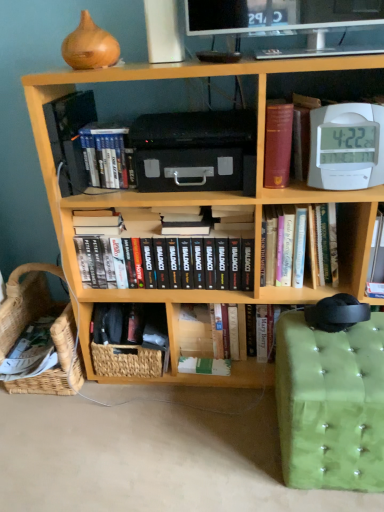
Question: Is wooden bookcase at center completely or partially outside of woven basket at lower left, acting as the 1th basket starting from the right?

Choices:
 (A) no
 (B) yes

Answer: (B)

Question: From a real-world perspective, is wooden bookcase at center under woven basket at lower left, the second basket viewed from the left?

Choices:
 (A) no
 (B) yes

Answer: (A)

Question: Is wooden bookcase at center shorter than woven basket at lower left, acting as the 1th basket starting from the right?

Choices:
 (A) no
 (B) yes

Answer: (A)

Question: Would you consider wooden bookcase at center to be distant from woven basket at lower left, the second basket viewed from the left?

Choices:
 (A) no
 (B) yes

Answer: (A)

Question: Is wooden bookcase at center beside woven basket at lower left, the second basket viewed from the left?

Choices:
 (A) no
 (B) yes

Answer: (A)

Question: Looking at the image, does white plastic clock at upper right, the fourth book from the left, seem bigger or smaller compared to woven natural basket at lower left, which ranks as the first basket in left-to-right order?

Choices:
 (A) big
 (B) small

Answer: (B)

Question: Which is correct: white plastic clock at upper right, acting as the first book starting from the right, is inside woven natural basket at lower left, the 2th basket in the right-to-left sequence, or outside of it?

Choices:
 (A) outside
 (B) inside

Answer: (A)

Question: Is white plastic clock at upper right, acting as the first book starting from the right, in front of or behind woven natural basket at lower left, which ranks as the first basket in left-to-right order, in the image?

Choices:
 (A) front
 (B) behind

Answer: (A)

Question: In terms of width, does white plastic clock at upper right, the fourth book from the left, look wider or thinner when compared to woven natural basket at lower left, the 2th basket in the right-to-left sequence?

Choices:
 (A) wide
 (B) thin

Answer: (B)

Question: In terms of width, does white paper at center, the third paperback book from the top, look wider or thinner when compared to hardcover book at center, the third book viewed from the left?

Choices:
 (A) wide
 (B) thin

Answer: (B)

Question: Relative to hardcover book at center, the second book viewed from the right, is white paper at center, the 2th paperback book viewed from the front, in front or behind?

Choices:
 (A) front
 (B) behind

Answer: (B)

Question: Is white paper at center, the third paperback book from the top, taller or shorter than hardcover book at center, the third book viewed from the left?

Choices:
 (A) short
 (B) tall

Answer: (A)

Question: Based on their sizes in the image, would you say white paper at center, the third paperback book from the top, is bigger or smaller than hardcover book at center, the second book viewed from the right?

Choices:
 (A) small
 (B) big

Answer: (A)

Question: Considering their positions, is green tufted fabric swivel chair at lower right located in front of or behind woven basket at lower left, the second basket viewed from the left?

Choices:
 (A) front
 (B) behind

Answer: (A)

Question: Is point (339, 369) positioned closer to the camera than point (94, 352)?

Choices:
 (A) closer
 (B) farther

Answer: (A)